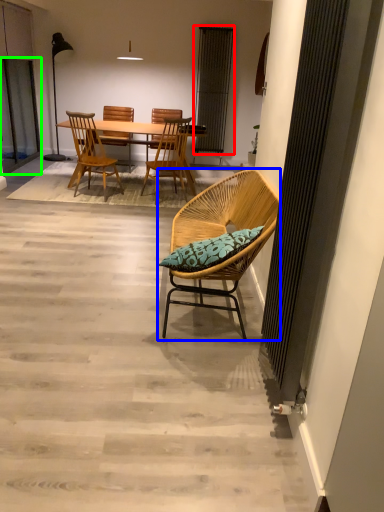
Question: Estimate the real-world distances between objects in this image. Which object is farther from curtain (highlighted by a red box), chair (highlighted by a blue box) or screen door (highlighted by a green box)?

Choices:
 (A) chair
 (B) screen door

Answer: (A)